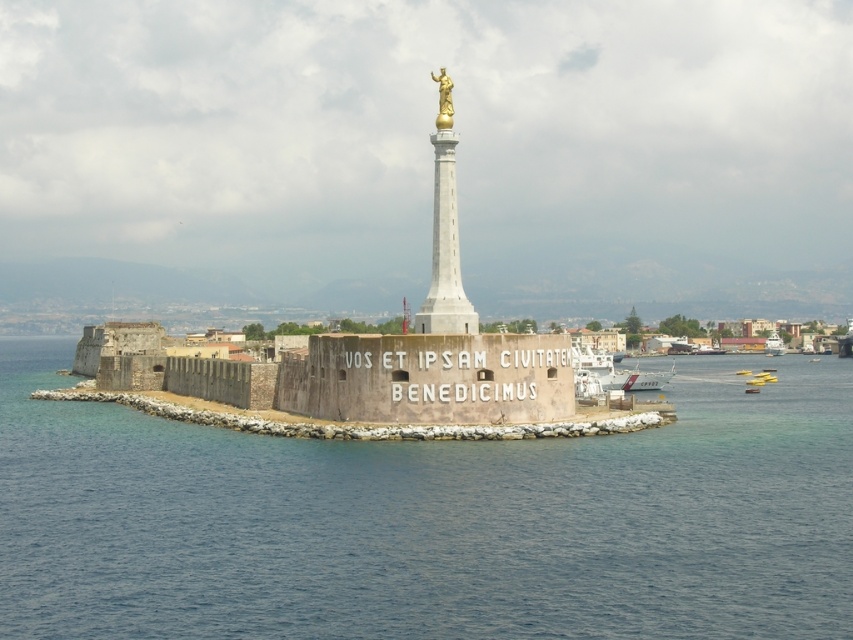
Question: Which object is positioned closest to the white plastic boat at lower right?

Choices:
 (A) gray concrete wall at center
 (B) gold polished statue at center
 (C) yellow plastic boat at lower right
 (D) blue water at center

Answer: (C)

Question: Which point is farther to the camera?

Choices:
 (A) gray concrete wall at center
 (B) gold polished statue at upper center

Answer: (B)

Question: Which object appears farthest from the camera in this image?

Choices:
 (A) gold polished statue at upper center
 (B) yellow plastic boat at lower right
 (C) blue water at center

Answer: (B)

Question: Does brown stone fort at center appear over gray concrete wall at center?

Choices:
 (A) no
 (B) yes

Answer: (B)

Question: Considering the relative positions of blue water at center and gray concrete wall at center in the image provided, where is blue water at center located with respect to gray concrete wall at center?

Choices:
 (A) below
 (B) above

Answer: (A)

Question: Does gray concrete wall at center appear on the right side of white plastic boat at lower right?

Choices:
 (A) yes
 (B) no

Answer: (B)